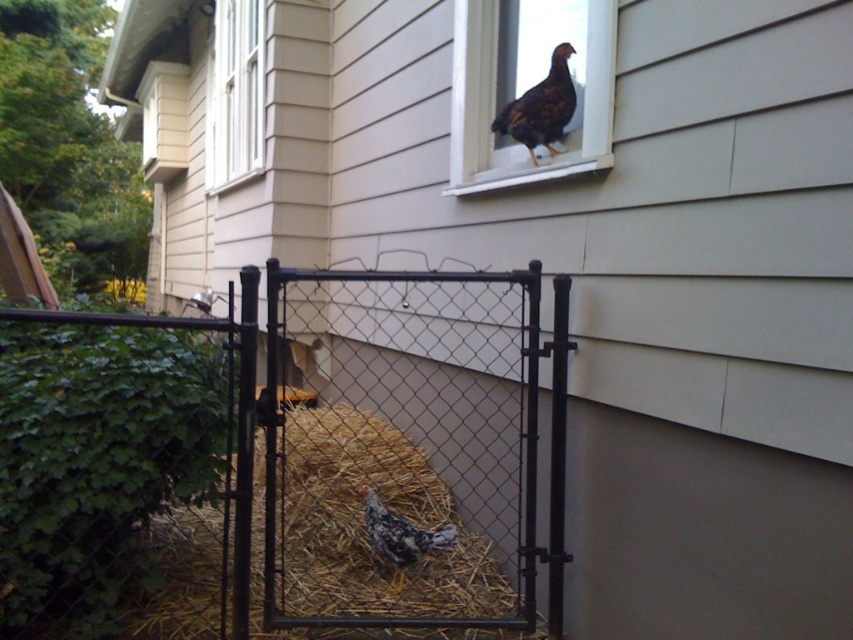
You are a delivery person approaching the house and need to locate the dark brown speckled chicken at upper center. Based on the scene, where should you look relative to the white painted wood window at upper left?

The dark brown speckled chicken at upper center is to the right of the white painted wood window at upper left.

You are a delivery person trying to locate the straw bedding at center in the image. Based on the coordinates provided, where would you find it?

Answer: The straw bedding at center is located at the coordinates point (363, 524).

In the scene shown: You are a farmer checking the yard. You see the straw bedding at center and the speckled feathered chicken at lower center. Which object is higher in height?

Answer: The straw bedding at center is taller than the speckled feathered chicken at lower center.